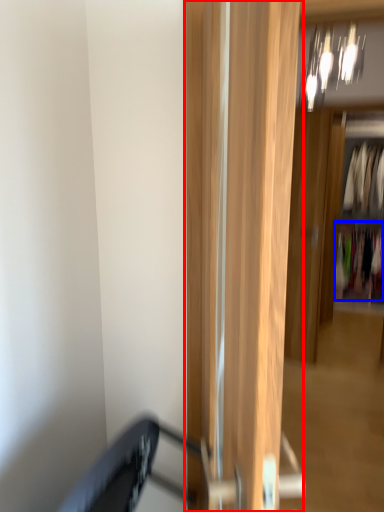
Question: Which of the following is the closest to the observer, door (highlighted by a red box) or clothing (highlighted by a blue box)?

Choices:
 (A) door
 (B) clothing

Answer: (A)